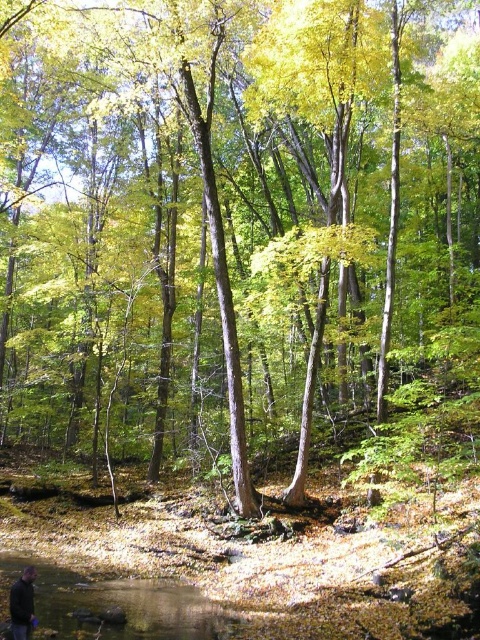
You are standing at the edge of the forest and see the clear water at lower left and the dark gray jacket at lower left. You want to place a 10 feet long wooden board between them to cross the stream. Will the board reach from one to the other?

The clear water at lower left is 10.24 feet from the dark gray jacket at lower left. Since the wooden board is 10 feet long, it will be slightly shorter than the distance between them, so it won not reach.

You are standing in the forest and see two points in the distance. The first point is at coordinates point (62, 612) and the second point is at point (9, 608). Which point is closer to you?

Point (62, 612) is closer to you because it is further to the viewer than point (9, 608).